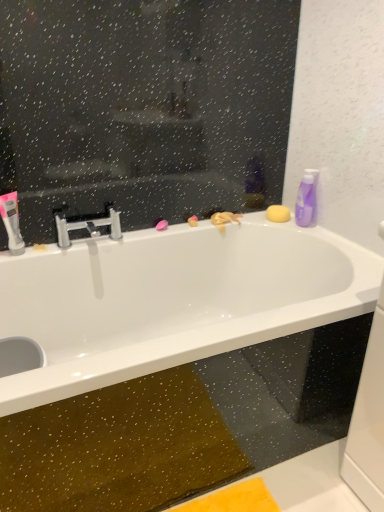
Question: Can you confirm if white glossy bathtub at upper center is thinner than polished chrome faucet at center?

Choices:
 (A) no
 (B) yes

Answer: (A)

Question: Could polished chrome faucet at center be considered to be inside white glossy bathtub at upper center?

Choices:
 (A) yes
 (B) no

Answer: (B)

Question: From a real-world perspective, is white glossy bathtub at upper center physically below polished chrome faucet at center?

Choices:
 (A) no
 (B) yes

Answer: (B)

Question: From a real-world perspective, is white glossy bathtub at upper center physically above polished chrome faucet at center?

Choices:
 (A) no
 (B) yes

Answer: (A)

Question: Does white glossy bathtub at upper center turn towards polished chrome faucet at center?

Choices:
 (A) yes
 (B) no

Answer: (B)

Question: Does white glossy bathtub at upper center lie in front of polished chrome faucet at center?

Choices:
 (A) yes
 (B) no

Answer: (A)

Question: Is white glossy toothpaste at left taller than purple glossy bottle at upper right?

Choices:
 (A) no
 (B) yes

Answer: (A)

Question: Is white glossy toothpaste at left with purple glossy bottle at upper right?

Choices:
 (A) yes
 (B) no

Answer: (B)

Question: From the image's perspective, is white glossy toothpaste at left located above purple glossy bottle at upper right?

Choices:
 (A) yes
 (B) no

Answer: (B)

Question: Considering the relative positions of white glossy toothpaste at left and purple glossy bottle at upper right in the image provided, is white glossy toothpaste at left to the right of purple glossy bottle at upper right from the viewer's perspective?

Choices:
 (A) no
 (B) yes

Answer: (A)

Question: Would you say white glossy toothpaste at left is a long distance from purple glossy bottle at upper right?

Choices:
 (A) no
 (B) yes

Answer: (B)

Question: Does white glossy toothpaste at left appear on the left side of purple glossy bottle at upper right?

Choices:
 (A) yes
 (B) no

Answer: (A)

Question: From a real-world perspective, is polished chrome faucet at center positioned over white glossy toothpaste at left based on gravity?

Choices:
 (A) no
 (B) yes

Answer: (A)